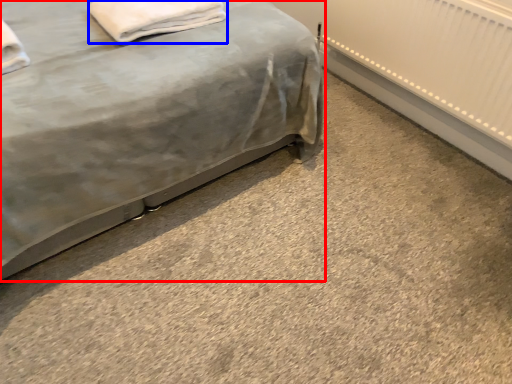
Question: Among these objects, which one is nearest to the camera, bed (highlighted by a red box) or material (highlighted by a blue box)?

Choices:
 (A) bed
 (B) material

Answer: (A)